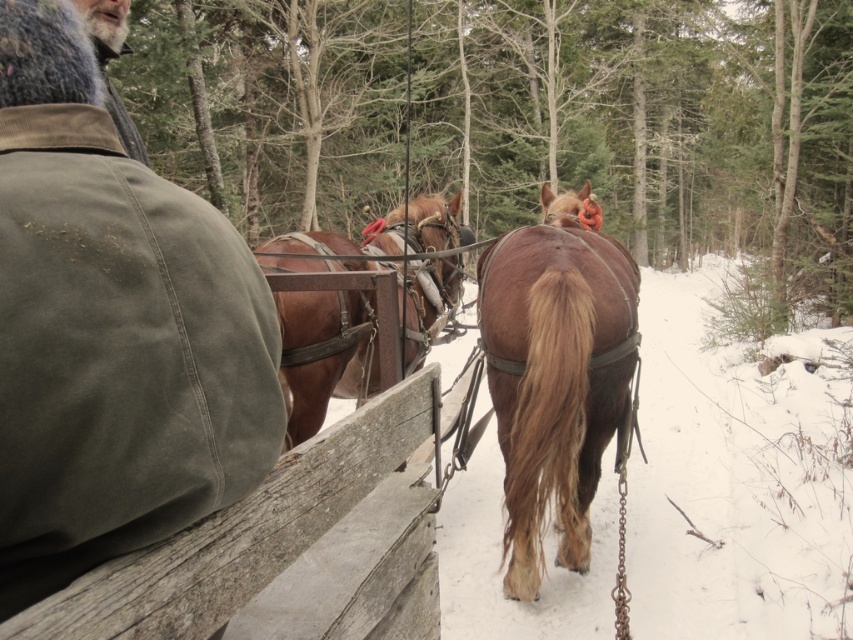
You are a photographer trying to capture a photo of the brown leather horse at center and the brown leather harness at center. Based on their sizes, which object should you focus on first to ensure it appears larger in your photo?

The brown leather horse at center is much taller than the brown leather harness at center, so you should focus on the brown leather horse at center first to ensure it appears larger in your photo.

You are standing in the snowy forest and see the green canvas coach at upper left. If you want to reach it from your current position, which direction should you move relative to the direction the sleigh is facing?

The green canvas coach at upper left is located at coordinates (112, 330), so you should move towards the upper left direction relative to the direction the sleigh is facing.

You are a passenger in the green canvas coach at upper left and want to look at the brown leather harness at center. Can you see it from your current position?

The green canvas coach at upper left is below the brown leather harness at center, so yes, you can see it from your current position.